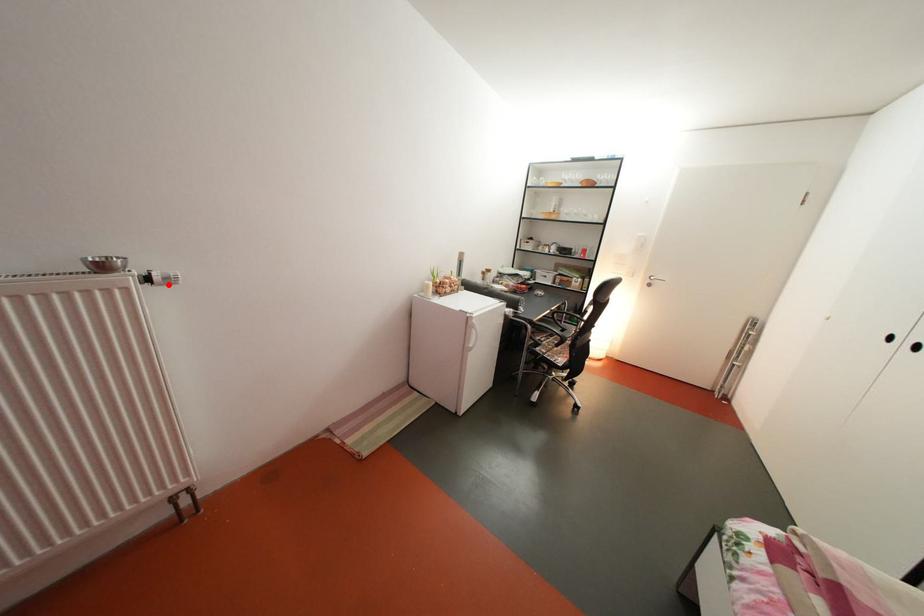
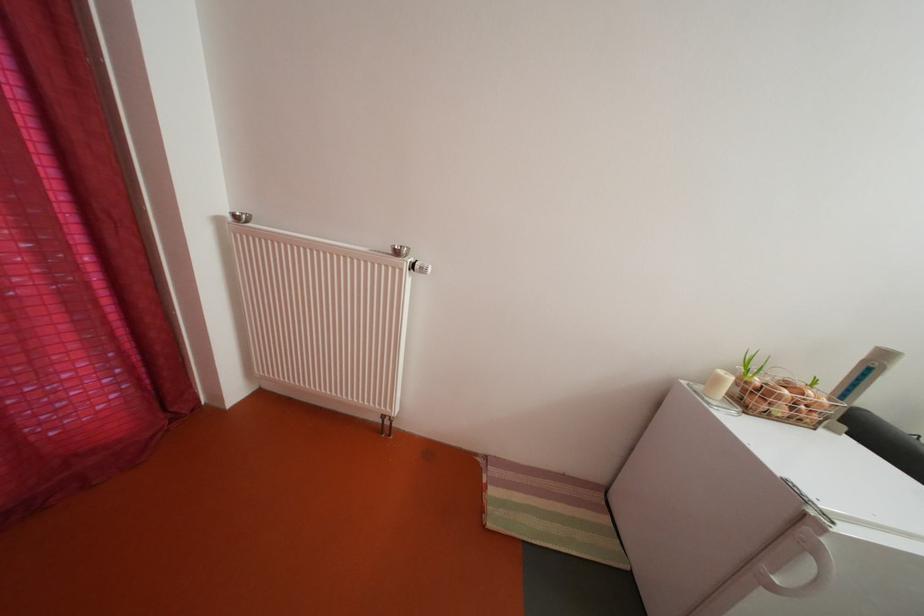
In the second image, find the point that corresponds to the highlighted location in the first image.

(429, 273)